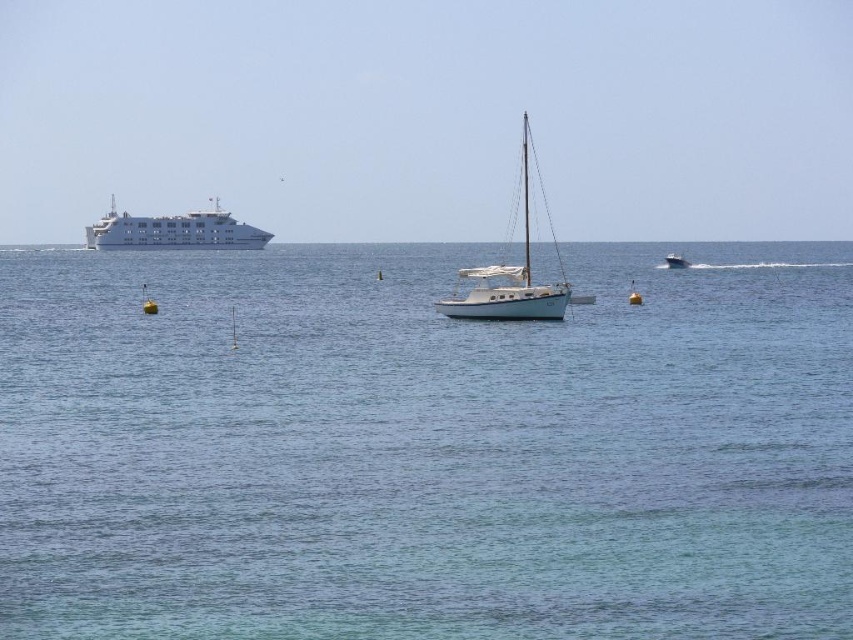
Between white glossy cruise ship at left and metallic blue boat at center, which one appears on the left side from the viewer's perspective?

white glossy cruise ship at left

From the picture: Does white glossy cruise ship at left have a greater height compared to metallic blue boat at center?

Yes, white glossy cruise ship at left is taller than metallic blue boat at center.

Who is more distant from viewer, (x=235, y=241) or (x=672, y=266)?

Positioned behind is point (x=235, y=241).

You are a GUI agent. You are given a task and a screenshot of the screen. Output one action in this format:
    pyautogui.click(x=<x>, y=<y>)
    Task: Click on the white glossy cruise ship at left
    The image size is (853, 640).
    Given the screenshot: What is the action you would take?
    pyautogui.click(x=173, y=230)

Can you confirm if clear blue water at center is wider than white matte sailboat at center?

Yes, clear blue water at center is wider than white matte sailboat at center.

Is clear blue water at center above white matte sailboat at center?

Incorrect, clear blue water at center is not positioned above white matte sailboat at center.

Identify the location of clear blue water at center. This screenshot has height=640, width=853. (424, 448).

Does white matte sailboat at center appear on the right side of metallic blue boat at center?

Incorrect, white matte sailboat at center is not on the right side of metallic blue boat at center.

Between white matte sailboat at center and metallic blue boat at center, which one is positioned lower?

metallic blue boat at center is below.

The width and height of the screenshot is (853, 640). I want to click on white matte sailboat at center, so click(x=512, y=275).